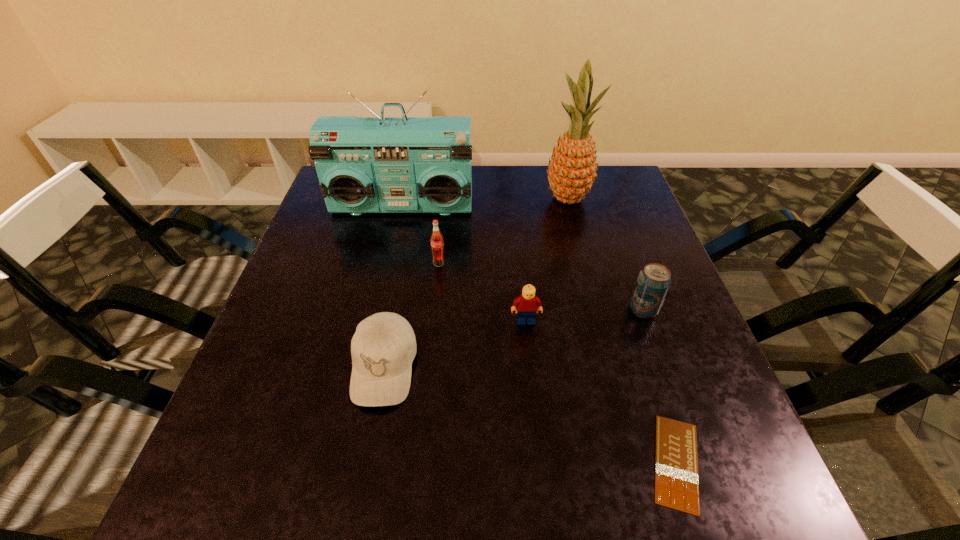
What are the coordinates of `free space between the farther pop soda and the fourth object from right to left` in the screenshot? It's located at (482, 292).

Where is `vacant area that lies between the pineapple and the baseball cap`? vacant area that lies between the pineapple and the baseball cap is located at coordinates (476, 282).

Identify the location of free space that is in between the pineapple and the radio receiver. The width and height of the screenshot is (960, 540). (485, 202).

Image resolution: width=960 pixels, height=540 pixels. What are the coordinates of `free space that is in between the fourth object from left to right and the third farthest object` in the screenshot? It's located at (482, 292).

Locate an element on the screen. Image resolution: width=960 pixels, height=540 pixels. free space between the farther pop soda and the shortest object is located at coordinates (558, 363).

Locate an element on the screen. The image size is (960, 540). empty space that is in between the left pop soda and the radio receiver is located at coordinates (420, 234).

You are a GUI agent. You are given a task and a screenshot of the screen. Output one action in this format:
    pyautogui.click(x=<x>, y=<y>)
    Task: Click on the free space between the right pop soda and the pineapple
    
    Given the screenshot: What is the action you would take?
    pyautogui.click(x=606, y=253)

You are a GUI agent. You are given a task and a screenshot of the screen. Output one action in this format:
    pyautogui.click(x=<x>, y=<y>)
    Task: Click on the free spot between the third farthest object and the nearest object
    The image size is (960, 540).
    Given the screenshot: What is the action you would take?
    pyautogui.click(x=558, y=363)

I want to click on free space between the radio receiver and the shortest object, so click(540, 334).

Where is `vacant area that lies between the chocolate bar and the pineapple`? vacant area that lies between the chocolate bar and the pineapple is located at coordinates (622, 330).